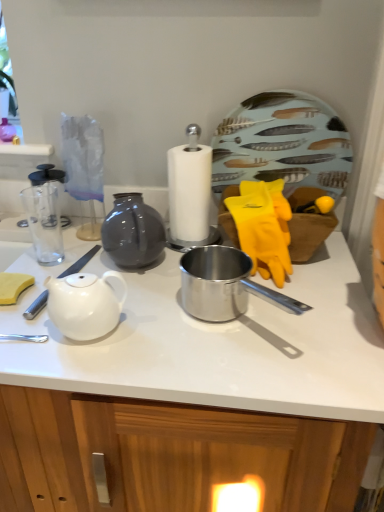
Question: Should I look upward or downward to see white glossy teapot at center-left?

Choices:
 (A) down
 (B) up

Answer: (A)

Question: From the image's perspective, is feather-patterned ceramic plate at upper right beneath white glossy teapot at left?

Choices:
 (A) no
 (B) yes

Answer: (A)

Question: Does feather-patterned ceramic plate at upper right lie in front of white glossy teapot at left?

Choices:
 (A) no
 (B) yes

Answer: (A)

Question: Is feather-patterned ceramic plate at upper right next to white glossy teapot at left and touching it?

Choices:
 (A) no
 (B) yes

Answer: (A)

Question: From the image's perspective, does feather-patterned ceramic plate at upper right appear higher than white glossy teapot at left?

Choices:
 (A) yes
 (B) no

Answer: (A)

Question: Is feather-patterned ceramic plate at upper right bigger than white glossy teapot at left?

Choices:
 (A) yes
 (B) no

Answer: (A)

Question: Is feather-patterned ceramic plate at upper right turned away from white glossy teapot at left?

Choices:
 (A) no
 (B) yes

Answer: (A)

Question: Is white glossy teapot at center-left surrounded by feather-patterned ceramic plate at upper right?

Choices:
 (A) no
 (B) yes

Answer: (A)

Question: Does feather-patterned ceramic plate at upper right have a greater height compared to white glossy teapot at center-left?

Choices:
 (A) yes
 (B) no

Answer: (A)

Question: Is feather-patterned ceramic plate at upper right not close to white glossy teapot at center-left?

Choices:
 (A) no
 (B) yes

Answer: (A)

Question: Does feather-patterned ceramic plate at upper right have a smaller size compared to white glossy teapot at center-left?

Choices:
 (A) no
 (B) yes

Answer: (B)

Question: From the image's perspective, is feather-patterned ceramic plate at upper right on top of white glossy teapot at center-left?

Choices:
 (A) no
 (B) yes

Answer: (B)

Question: From a real-world perspective, is feather-patterned ceramic plate at upper right on white glossy teapot at center-left?

Choices:
 (A) yes
 (B) no

Answer: (A)

Question: Can you confirm if white glossy teapot at left is smaller than white glossy teapot at center-left?

Choices:
 (A) no
 (B) yes

Answer: (B)